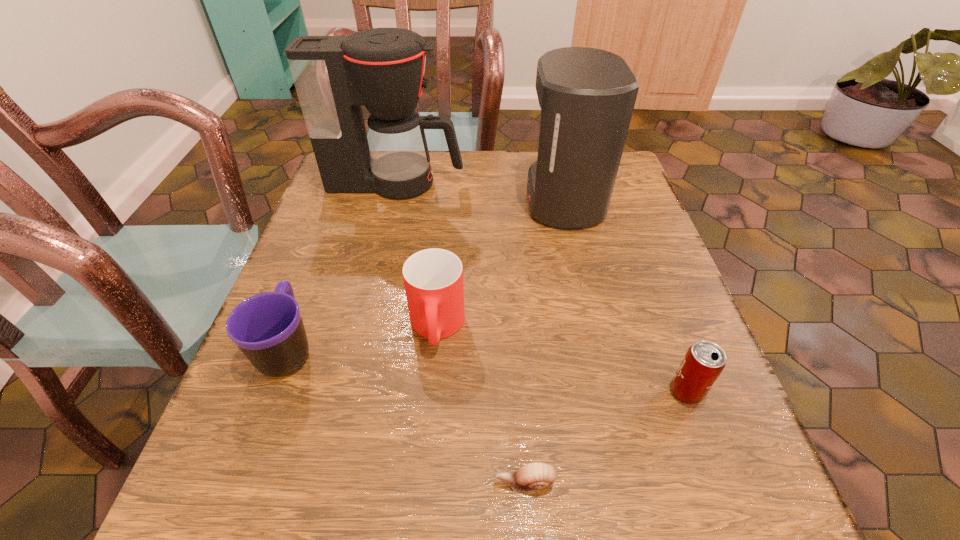
Identify the location of vacant space located 0.340m on the button side of the right coffee maker. (385, 200).

Locate an element on the screen. The height and width of the screenshot is (540, 960). vacant area located on the side of the cup with the handle is located at coordinates (426, 447).

Find the location of `vacant space located with the handle on the side of the mug`. vacant space located with the handle on the side of the mug is located at coordinates (345, 196).

I want to click on vacant space located 0.280m with the handle on the side of the mug, so click(336, 221).

This screenshot has height=540, width=960. What are the coordinates of `free space located with the handle on the side of the mug` in the screenshot? It's located at (333, 227).

This screenshot has height=540, width=960. I want to click on free region located on the front of the beer can, so click(733, 520).

I want to click on vacant space situated 0.250m on the front-facing side of the escargot, so click(x=312, y=483).

Find the location of a particular element. free space located 0.150m on the front-facing side of the escargot is located at coordinates [x=386, y=483].

Find the location of a particular element. The width and height of the screenshot is (960, 540). free region located on the front-facing side of the escargot is located at coordinates (400, 483).

This screenshot has width=960, height=540. In order to click on object that is at the near edge in this screenshot , I will do `click(534, 476)`.